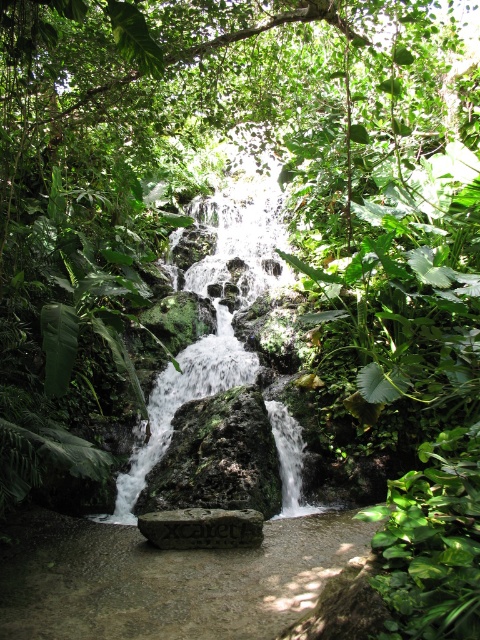
You are standing at the base of the waterfall in the tropical scene. There is a smooth stone path at center. Can you see the point at coordinates point [166,579] from where you are standing?

Yes, the point [166,579] is on the smooth stone path at center, so it should be visible from the base of the waterfall.

You are a hiker who wants to cross the smooth stone path at center without getting wet. The gray stone at center has a slippery surface. Which stone should you step on first?

You should step on the smooth stone path at center first because it is located below the gray stone at center, so it is lower and less likely to be splashed by water from above.

You are standing at the base of the tropical waterfall and want to find the smooth stone path at center. According to the coordinates given, where should you look to find it?

The smooth stone path at center is located at the 2D coordinates point (x=166, y=579), so you should look towards the lower right area of the image to find it.